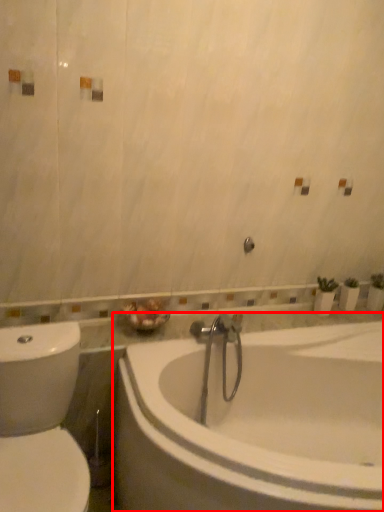
Question: Observing the image, what is the correct spatial positioning of bathtub (annotated by the red box) in reference to toilet?

Choices:
 (A) right
 (B) left

Answer: (A)